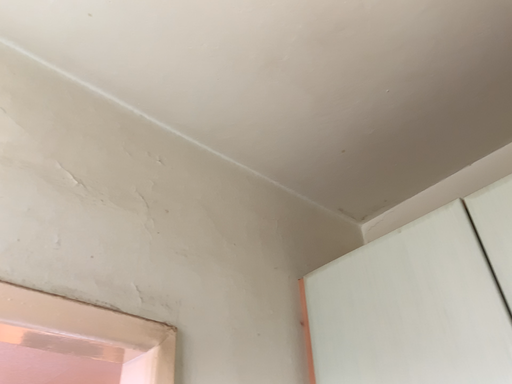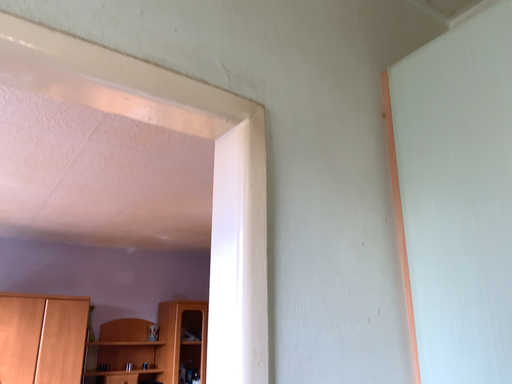
Question: Which way did the camera rotate in the video?

Choices:
 (A) rotated downward
 (B) rotated upward

Answer: (A)